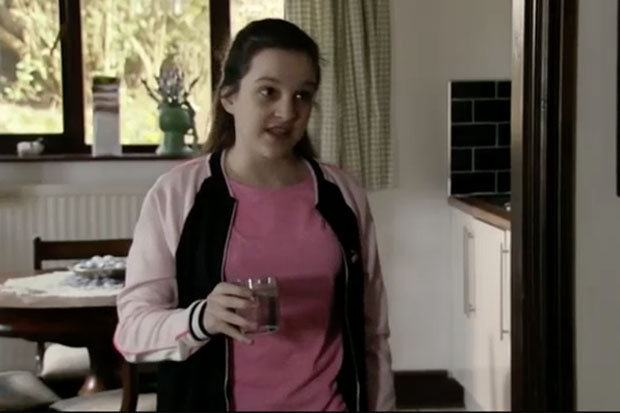
Where is `vase`? The height and width of the screenshot is (413, 620). vase is located at coordinates (175, 117).